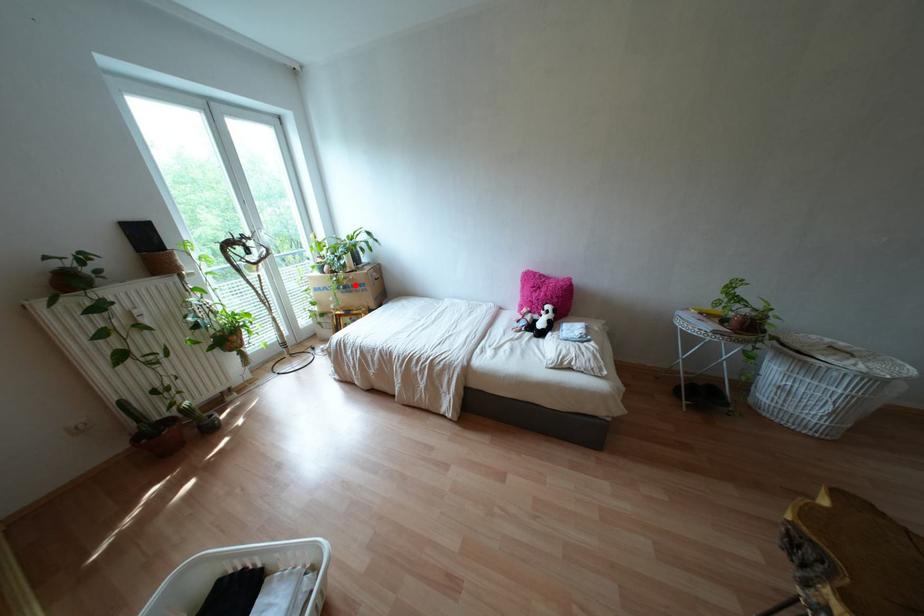
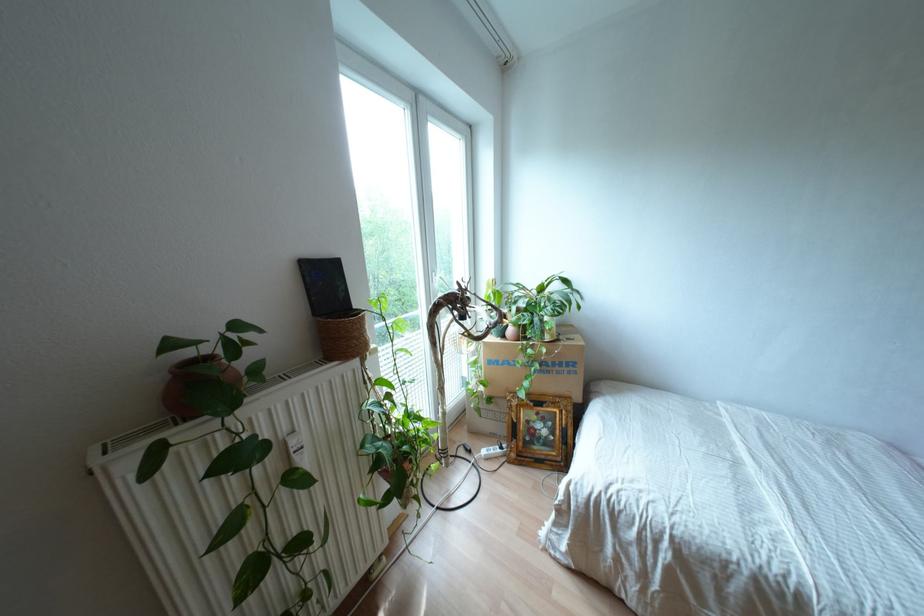
Where in the second image is the point corresponding to the highlighted location from the first image?

(560, 363)